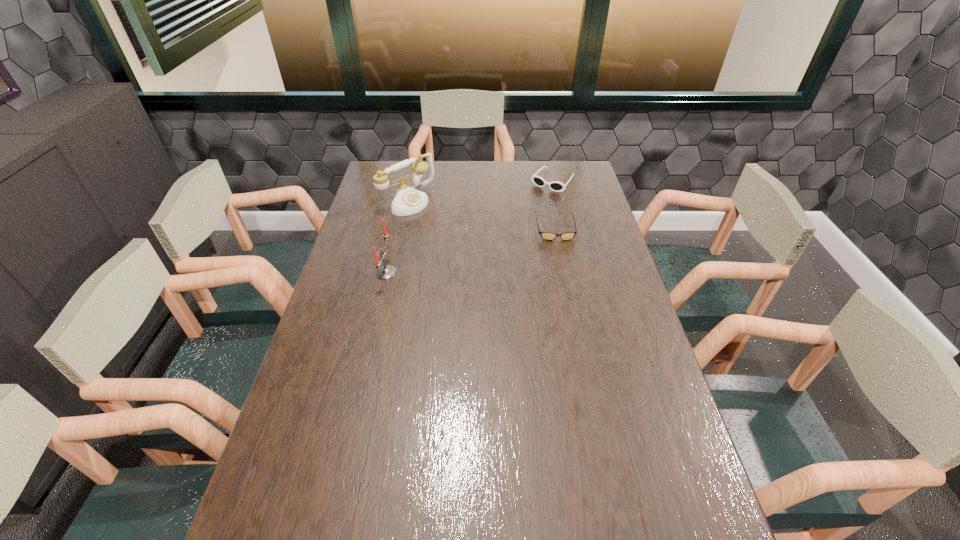
At what (x,y) coordinates should I click in order to perform the action: click on vacant space that is in between the shortest object and the farther sunglasses. Please return your answer as a coordinate pair (x, y). This screenshot has width=960, height=540. Looking at the image, I should click on (554, 205).

The width and height of the screenshot is (960, 540). In order to click on empty location between the candle and the telephone in this screenshot , I will do `click(397, 237)`.

Identify the location of empty space between the farther sunglasses and the shortest object. This screenshot has width=960, height=540. (554, 205).

The height and width of the screenshot is (540, 960). In order to click on vacant point located between the telephone and the nearest object in this screenshot , I will do `click(397, 237)`.

Find the location of `free space between the shortest object and the telephone`. free space between the shortest object and the telephone is located at coordinates (482, 215).

The height and width of the screenshot is (540, 960). In order to click on vacant space that is in between the second nearest object and the farther sunglasses in this screenshot , I will do `click(554, 205)`.

This screenshot has width=960, height=540. Identify the location of blank region between the telephone and the third farthest object. (482, 215).

This screenshot has width=960, height=540. What are the coordinates of `object that ranks as the third closest to the telephone` in the screenshot? It's located at (556, 186).

The width and height of the screenshot is (960, 540). I want to click on object identified as the third closest to the telephone, so 556,186.

Where is `free spot that satisfies the following two spatial constraints: 1. on the back side of the second shortest object; 2. on the left side of the telephone`? Image resolution: width=960 pixels, height=540 pixels. free spot that satisfies the following two spatial constraints: 1. on the back side of the second shortest object; 2. on the left side of the telephone is located at coordinates (412, 181).